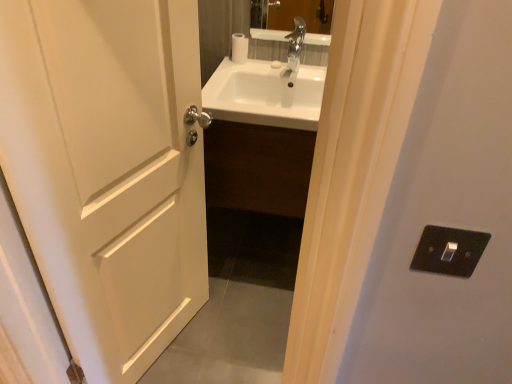
This screenshot has height=384, width=512. Find the location of `empty space that is to the right of white matte toilet paper at upper center`. empty space that is to the right of white matte toilet paper at upper center is located at coordinates (267, 61).